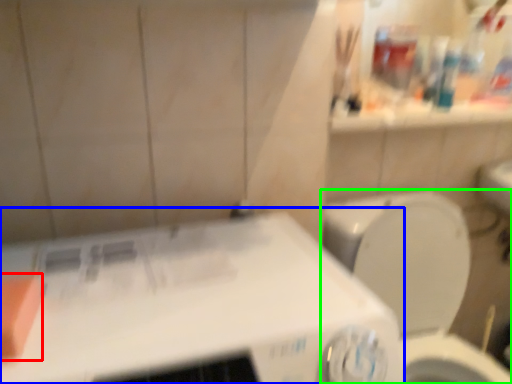
Question: Which object is the closest to the soap (highlighted by a red box)? Choose among these: appliance (highlighted by a blue box) or toilet (highlighted by a green box).

Choices:
 (A) appliance
 (B) toilet

Answer: (A)